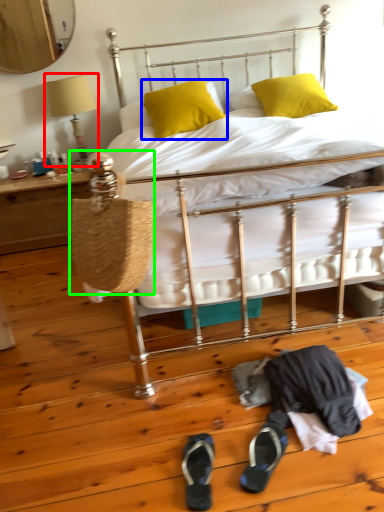
Question: Which object is positioned closest to table lamp (highlighted by a red box)? Select from pillow (highlighted by a blue box) and handbag (highlighted by a green box).

Choices:
 (A) pillow
 (B) handbag

Answer: (A)